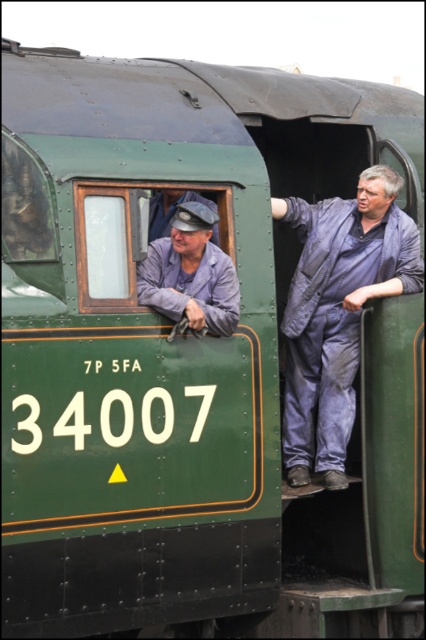
Who is shorter, matte blue uniform at center or denim cap at left?

denim cap at left is shorter.

Which is more to the right, matte blue uniform at center or denim cap at left?

From the viewer's perspective, matte blue uniform at center appears more on the right side.

Does point (212, 268) lie behind point (201, 198)?

No.

Find the location of a particular element. matte blue uniform at center is located at coordinates (190, 273).

Identify the location of blue denim jumpsuit at right. The image size is (426, 640). (337, 312).

You are a GUI agent. You are given a task and a screenshot of the screen. Output one action in this format:
    pyautogui.click(x=<x>, y=<y>)
    Task: Click on the blue denim jumpsuit at right
    
    Given the screenshot: What is the action you would take?
    pyautogui.click(x=337, y=312)

Is blue denim jumpsuit at right to the right of denim cap at left from the viewer's perspective?

Yes, blue denim jumpsuit at right is to the right of denim cap at left.

Which is below, blue denim jumpsuit at right or denim cap at left?

Positioned lower is blue denim jumpsuit at right.

Image resolution: width=426 pixels, height=640 pixels. In order to click on blue denim jumpsuit at right in this screenshot , I will do `click(337, 312)`.